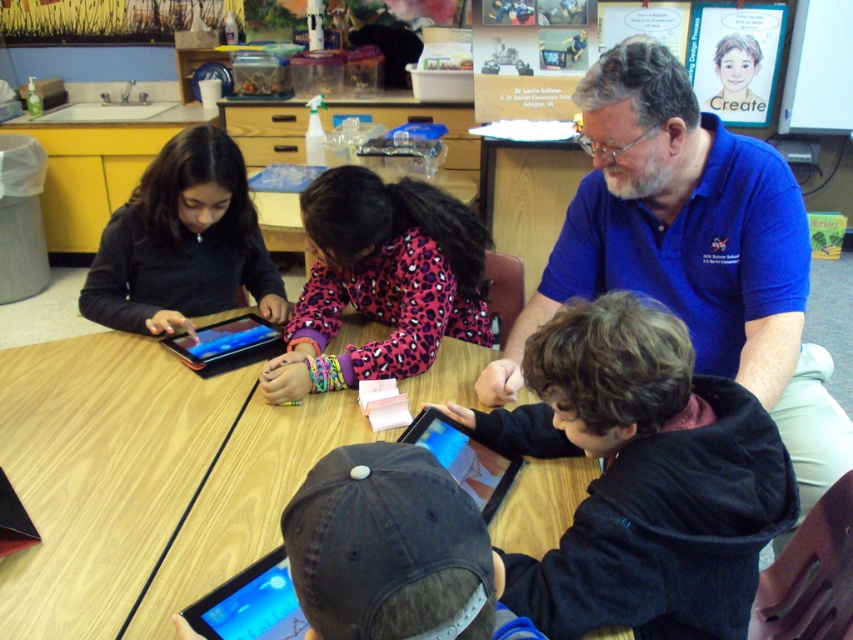
From the picture: Is wooden table at center smaller than pink leopard print sweater at center?

No.

What do you see at coordinates (143, 481) in the screenshot? This screenshot has height=640, width=853. I see `wooden table at center` at bounding box center [143, 481].

This screenshot has height=640, width=853. I want to click on wooden table at center, so click(143, 481).

Can you confirm if matte black tablet at left is smaller than black glossy tablet at lower center?

Incorrect, matte black tablet at left is not smaller in size than black glossy tablet at lower center.

Is the position of matte black tablet at left less distant than that of black glossy tablet at lower center?

No, it is not.

Does point (256, 241) come farther from viewer compared to point (479, 474)?

Yes, point (256, 241) is farther from viewer.

I want to click on matte black tablet at left, so click(183, 243).

Who is shorter, blue cotton shirt at upper right or pink leopard print sweater at center?

With less height is pink leopard print sweater at center.

Is blue cotton shirt at upper right bigger than pink leopard print sweater at center?

Yes, blue cotton shirt at upper right is bigger than pink leopard print sweater at center.

This screenshot has height=640, width=853. Find the location of `blue cotton shirt at upper right`. blue cotton shirt at upper right is located at coordinates (691, 250).